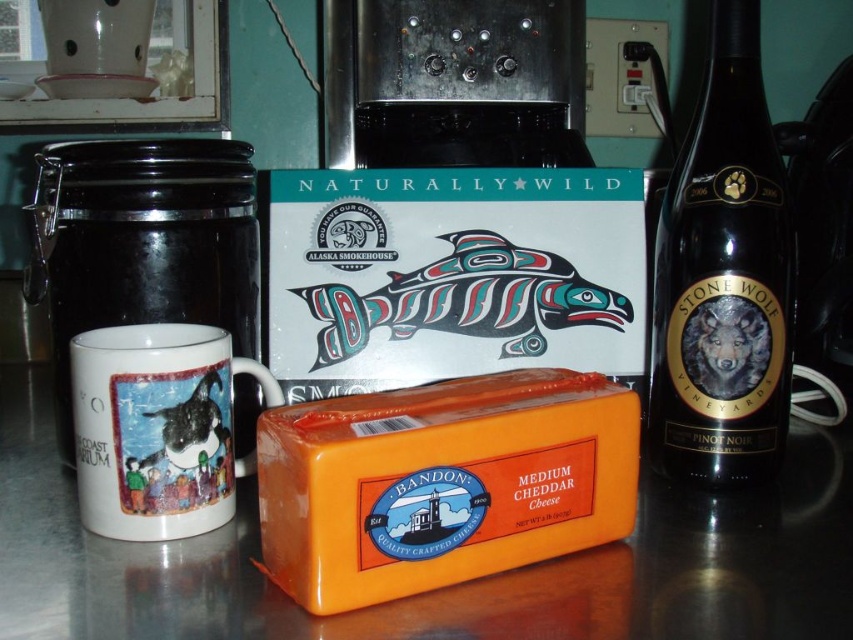
You are setting up a table for a dinner party and need to place the black glass bottle at right and the white glossy mug at left. If you want to arrange them vertically in a row from tallest to shortest, which order should you place them in?

The black glass bottle at right is much taller than the white glossy mug at left, so you should place the black glass bottle at right first, followed by the white glossy mug at left.

You are standing in front of the kitchen countertop scene. You need to place a new item exactly at the position where the white glossy mug at lower left is currently located. Where should you place it?

You should place the new item at the 2D coordinates point (157, 428) where the white glossy mug at lower left is located.

You are setting up a table for a dinner party and need to arrange the white glossy mug at lower left and the multicolored painted fish at center. Which item should you place in a spot where height matters, like a shelf or a high table, to ensure it doesn

The white glossy mug at lower left is taller than the multicolored painted fish at center, so it should be placed in a spot where height matters to ensure it stands out appropriately.